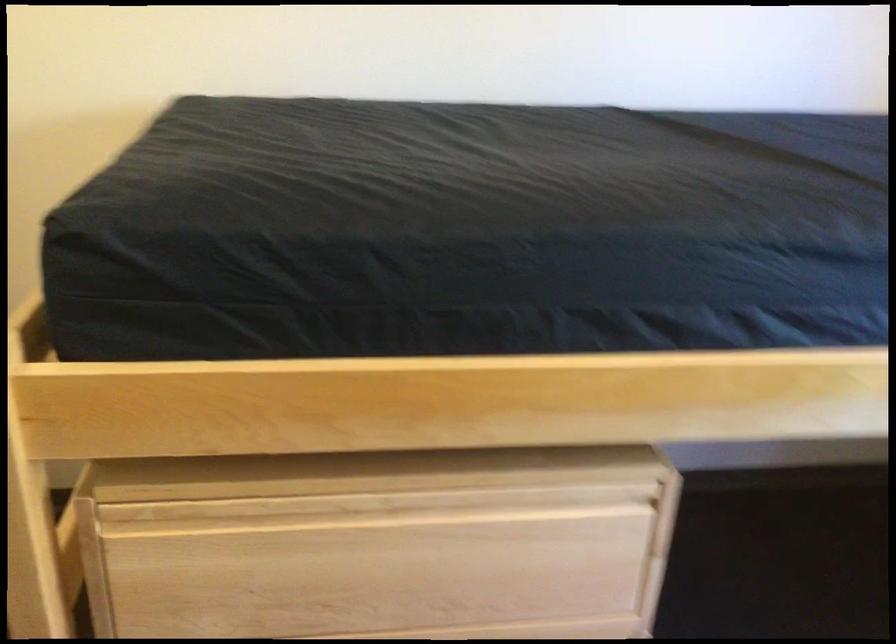
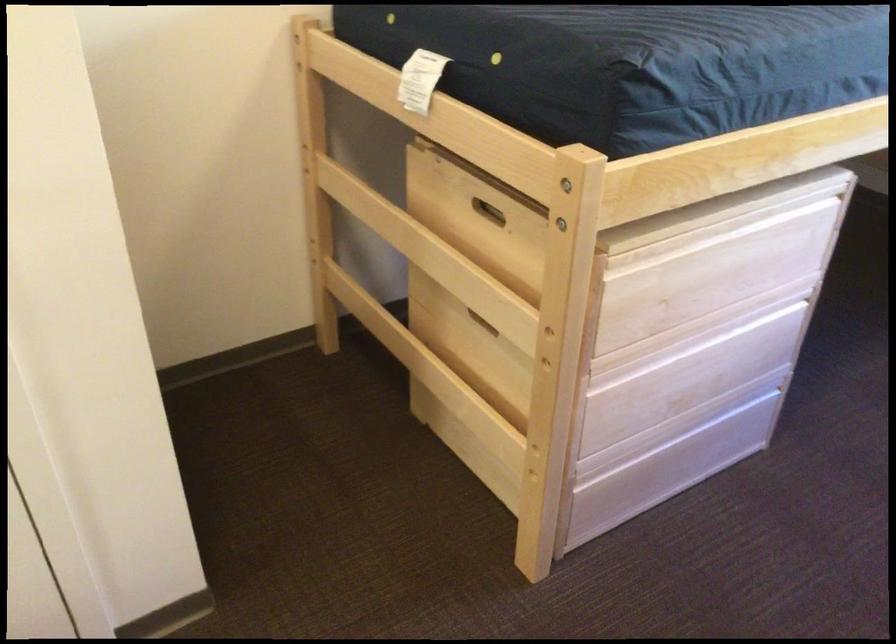
Where in the second image is the point corresponding to (x=369, y=502) from the first image?

(720, 230)